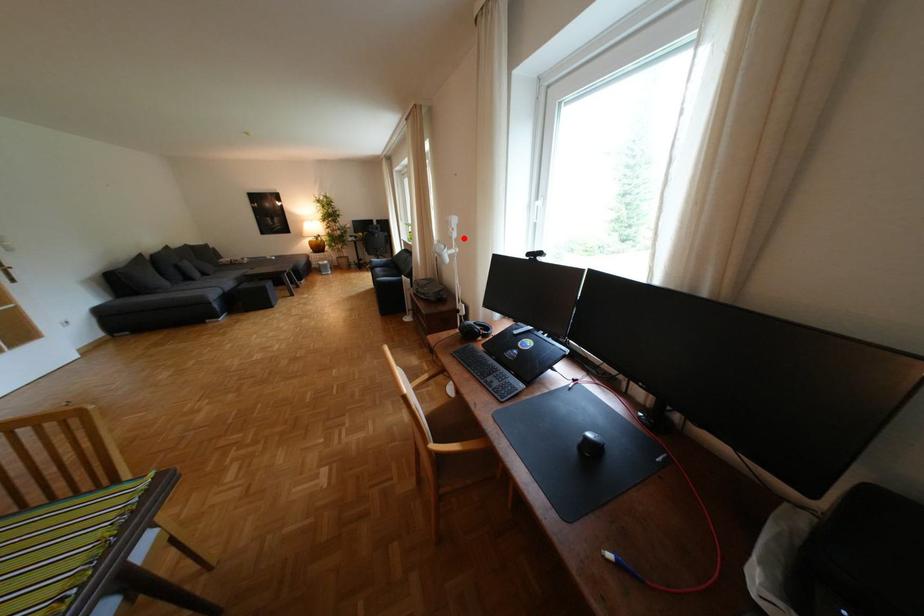
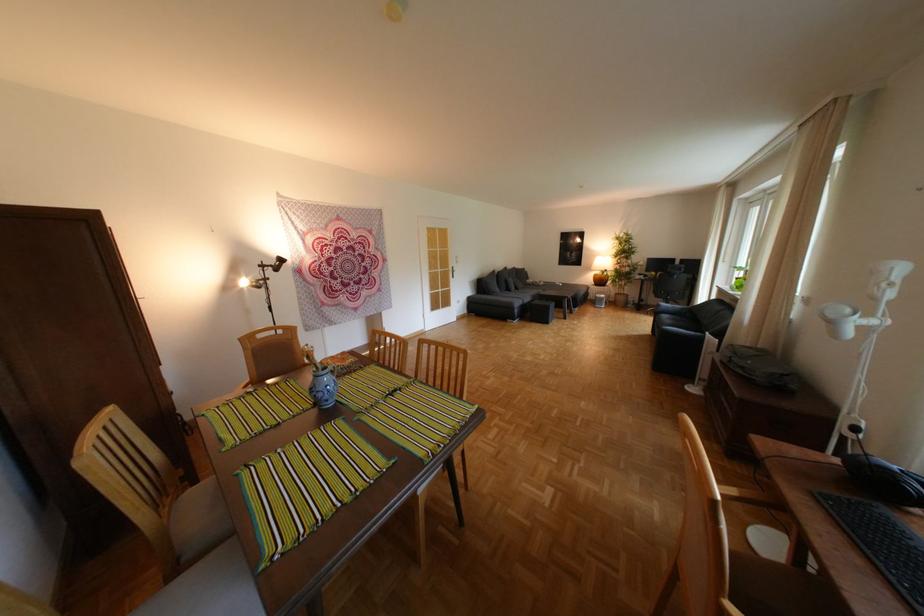
Question: I am providing you with two images of the same scene from different viewpoints. Image1 has a red point marked. In image2, the corresponding 3D location appears at what relative position? Reply with the corresponding letter.

Choices:
 (A) Closer
 (B) Farther

Answer: (B)